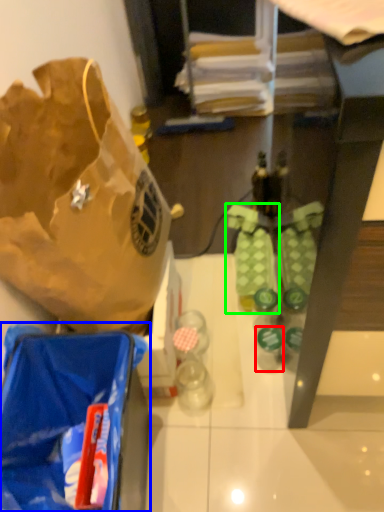
Question: Which object is the closest to the bottle (highlighted by a red box)? Choose among these: luggage and bags (highlighted by a blue box) or footwear (highlighted by a green box).

Choices:
 (A) luggage and bags
 (B) footwear

Answer: (B)